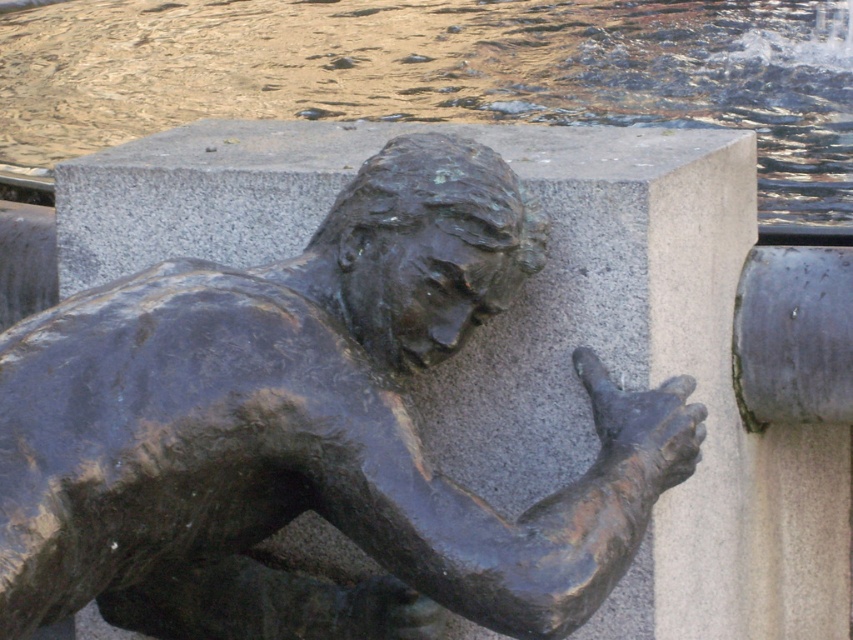
Can you confirm if bronze statue at center is thinner than glistening water at upper center?

Yes.

Does bronze statue at center have a lesser height compared to glistening water at upper center?

Yes, bronze statue at center is shorter than glistening water at upper center.

Who is more distant from viewer, (296, 294) or (26, 48)?

The point (26, 48) is more distant.

You are a GUI agent. You are given a task and a screenshot of the screen. Output one action in this format:
    pyautogui.click(x=<x>, y=<y>)
    Task: Click on the bronze statue at center
    
    Given the screenshot: What is the action you would take?
    pyautogui.click(x=309, y=429)